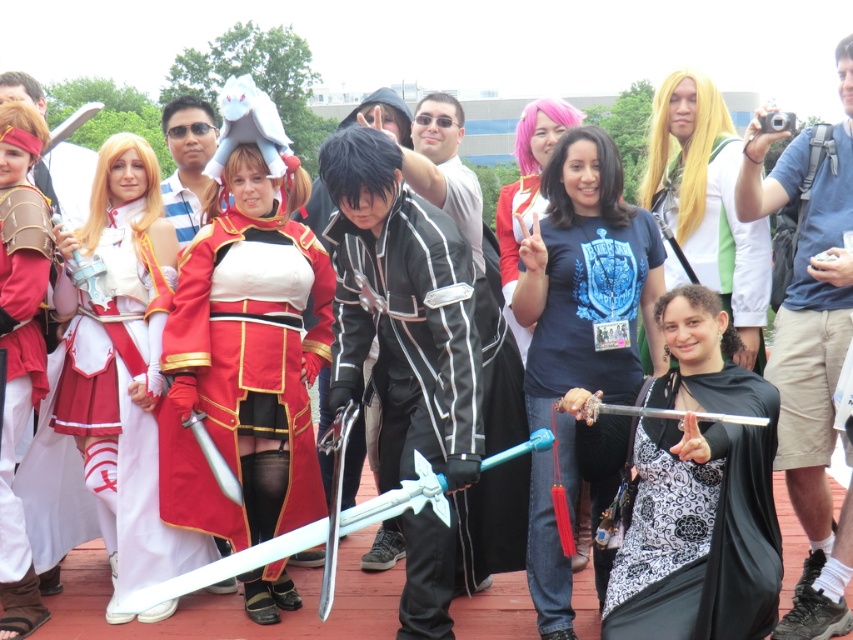
Can you confirm if black matte sword at center is positioned above black satin cape at center?

Incorrect, black matte sword at center is not positioned above black satin cape at center.

Find the location of a particular element. This screenshot has height=640, width=853. black matte sword at center is located at coordinates (589, 305).

Between blue denim shorts at lower right and matte black sunglasses at center, which one has more height?

blue denim shorts at lower right

Between blue denim shorts at lower right and matte black sunglasses at center, which one appears on the right side from the viewer's perspective?

Positioned to the right is blue denim shorts at lower right.

Is point (761, 147) closer to viewer compared to point (183, 152)?

Yes, point (761, 147) is in front of point (183, 152).

Find the location of a particular element. This screenshot has width=853, height=640. blue denim shorts at lower right is located at coordinates (810, 342).

Can you confirm if black satin cape at center is taller than green fabric dress at center?

Incorrect, black satin cape at center's height is not larger of green fabric dress at center's.

Based on the photo, does black satin cape at center have a greater width compared to green fabric dress at center?

In fact, black satin cape at center might be narrower than green fabric dress at center.

Is point (744, 476) positioned in front of point (717, 260)?

Yes, point (744, 476) is in front of point (717, 260).

The image size is (853, 640). In order to click on black satin cape at center in this screenshot , I will do `click(741, 513)`.